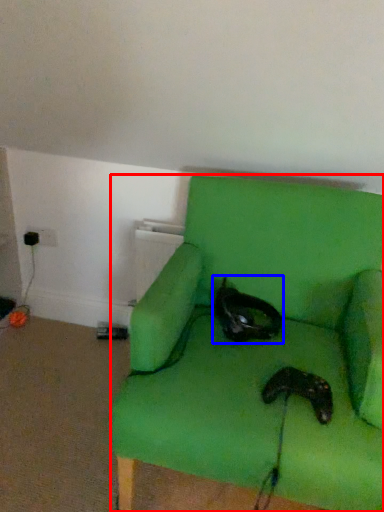
Question: Which of the following is the farthest to the observer, chair (highlighted by a red box) or cat (highlighted by a blue box)?

Choices:
 (A) chair
 (B) cat

Answer: (B)